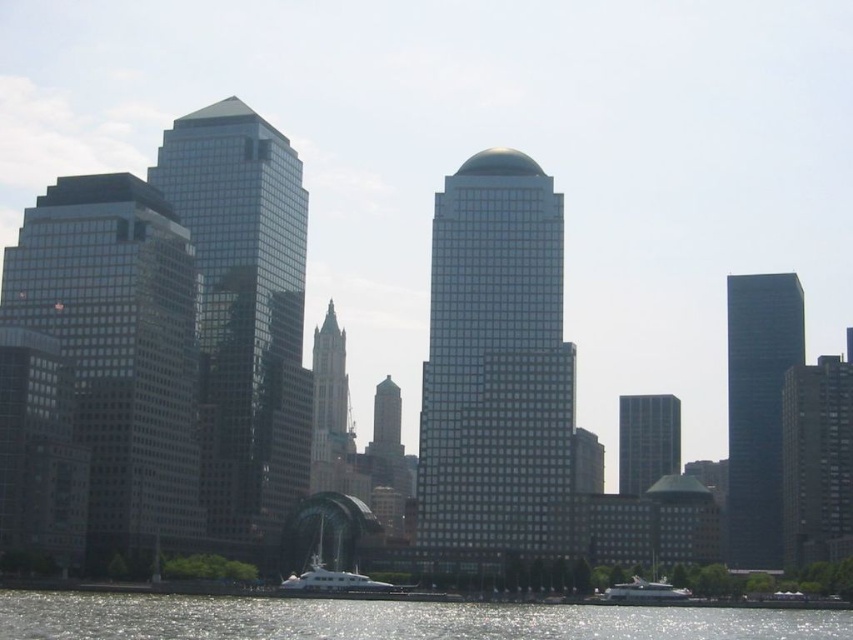
Who is more forward, (276, 285) or (769, 368)?

Point (276, 285) is in front.

Where is `shiny glass skyscraper at center`? The width and height of the screenshot is (853, 640). shiny glass skyscraper at center is located at coordinates (244, 312).

Locate an element on the screen. glassy steel skyscraper at center is located at coordinates [x=495, y=365].

Between glassy steel skyscraper at center and white glossy yacht at lower center, which one appears on the left side from the viewer's perspective?

white glossy yacht at lower center is more to the left.

Which is in front, point (543, 340) or point (316, 573)?

Positioned in front is point (316, 573).

Find the location of a particular element. The image size is (853, 640). glassy steel skyscraper at center is located at coordinates (495, 365).

Who is more distant from viewer, (570,460) or (187,440)?

The point (570,460) is behind.

Which is above, glassy steel skyscraper at center or matte glass skyscraper at left?

glassy steel skyscraper at center is higher up.

Who is more distant from viewer, (492, 310) or (120, 330)?

The point (492, 310) is behind.

This screenshot has width=853, height=640. I want to click on glassy steel skyscraper at center, so click(495, 365).